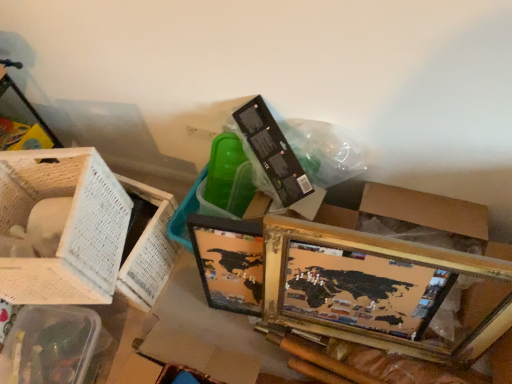
Question: Can you confirm if clear plastic basket at lower left, which is counted as the 1th basket, starting from the bottom, is smaller than white woven basket at left, which appears as the 1th basket when viewed from the top?

Choices:
 (A) no
 (B) yes

Answer: (B)

Question: Can you confirm if clear plastic basket at lower left, which is counted as the 1th basket, starting from the bottom, is shorter than white woven basket at left, which is the second basket from bottom to top?

Choices:
 (A) yes
 (B) no

Answer: (A)

Question: Is clear plastic basket at lower left, which appears as the 2th basket when viewed from the top, taller than white woven basket at left, which is the second basket from bottom to top?

Choices:
 (A) yes
 (B) no

Answer: (B)

Question: Is clear plastic basket at lower left, which is counted as the 1th basket, starting from the bottom, at the right side of white woven basket at left, which appears as the 1th basket when viewed from the top?

Choices:
 (A) yes
 (B) no

Answer: (B)

Question: Is the depth of clear plastic basket at lower left, which appears as the 2th basket when viewed from the top, greater than that of white woven basket at left, which appears as the 1th basket when viewed from the top?

Choices:
 (A) no
 (B) yes

Answer: (B)

Question: From the image's perspective, is white woven basket at left, which appears as the 1th basket when viewed from the top, above or below gold-framed map at lower right?

Choices:
 (A) below
 (B) above

Answer: (B)

Question: Looking at their shapes, would you say white woven basket at left, which is the second basket from bottom to top, is wider or thinner than gold-framed map at lower right?

Choices:
 (A) thin
 (B) wide

Answer: (B)

Question: Relative to gold-framed map at lower right, is white woven basket at left, which appears as the 1th basket when viewed from the top, in front or behind?

Choices:
 (A) behind
 (B) front

Answer: (A)

Question: Is white woven basket at left, which is the second basket from bottom to top, bigger or smaller than gold-framed map at lower right?

Choices:
 (A) small
 (B) big

Answer: (A)

Question: Considering their positions, is clear plastic basket at lower left, which is counted as the 1th basket, starting from the bottom, located in front of or behind gold-framed map at lower right?

Choices:
 (A) behind
 (B) front

Answer: (A)

Question: Would you say clear plastic basket at lower left, which is counted as the 1th basket, starting from the bottom, is to the left or to the right of gold-framed map at lower right in the picture?

Choices:
 (A) left
 (B) right

Answer: (A)

Question: From the image's perspective, is clear plastic basket at lower left, which appears as the 2th basket when viewed from the top, above or below gold-framed map at lower right?

Choices:
 (A) below
 (B) above

Answer: (A)

Question: From their relative heights in the image, would you say clear plastic basket at lower left, which appears as the 2th basket when viewed from the top, is taller or shorter than gold-framed map at lower right?

Choices:
 (A) short
 (B) tall

Answer: (A)

Question: Is white woven basket at left, which appears as the 1th basket when viewed from the top, bigger or smaller than clear plastic basket at lower left, which is counted as the 1th basket, starting from the bottom?

Choices:
 (A) big
 (B) small

Answer: (A)

Question: From a real-world perspective, is white woven basket at left, which is the second basket from bottom to top, positioned above or below clear plastic basket at lower left, which is counted as the 1th basket, starting from the bottom?

Choices:
 (A) above
 (B) below

Answer: (A)